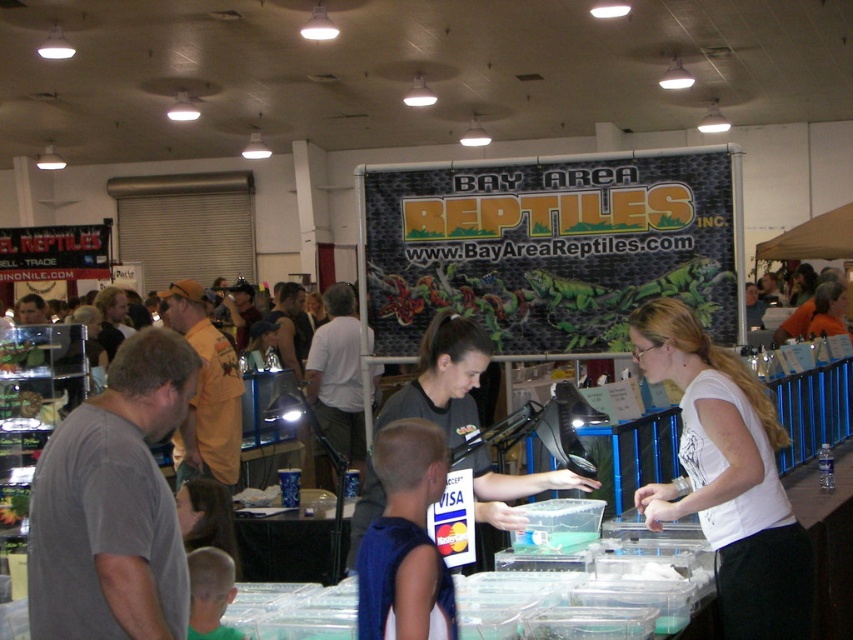
Who is positioned more to the left, white matte shirt at center or dark gray shirt at center?

dark gray shirt at center is more to the left.

Who is more forward, (709,417) or (485,346)?

Point (709,417) is more forward.

Image resolution: width=853 pixels, height=640 pixels. What do you see at coordinates (727, 476) in the screenshot?
I see `white matte shirt at center` at bounding box center [727, 476].

Find the location of a particular element. This screenshot has width=853, height=640. white matte shirt at center is located at coordinates (727, 476).